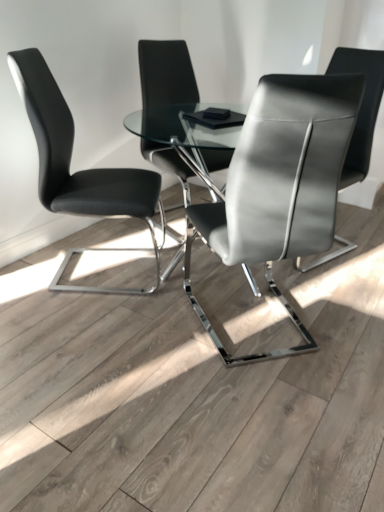
At what (x,y) coordinates should I click in order to perform the action: click on vacant area located to the right-hand side of satin gray leather chair at center, placed as the 3th chair when sorted from left to right. Please return your answer as a coordinate pair (x, y). Image resolution: width=384 pixels, height=512 pixels. Looking at the image, I should click on (353, 326).